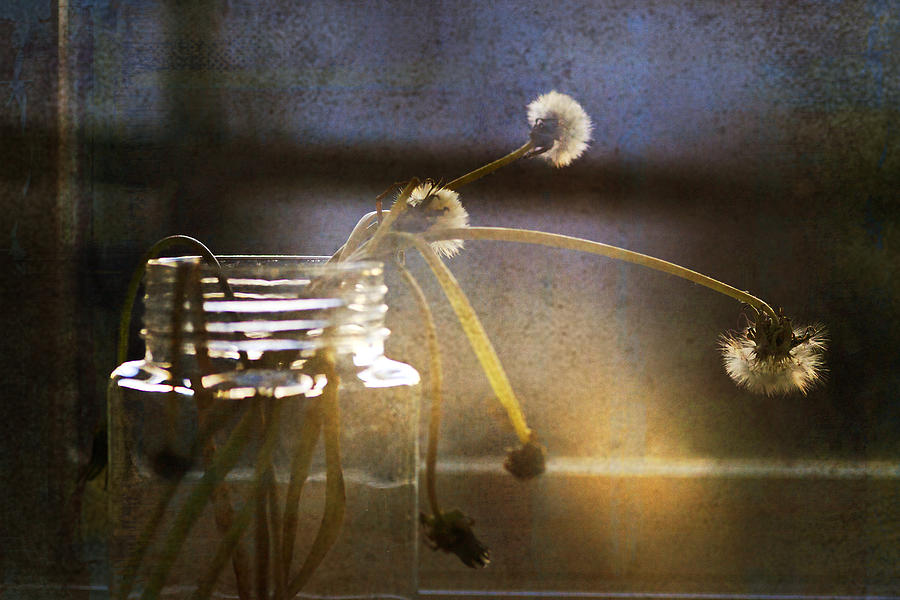
At what (x,y) coordinates should I click in order to perform the action: click on glass. Please return your answer as a coordinate pair (x, y). Looking at the image, I should click on (205, 478).